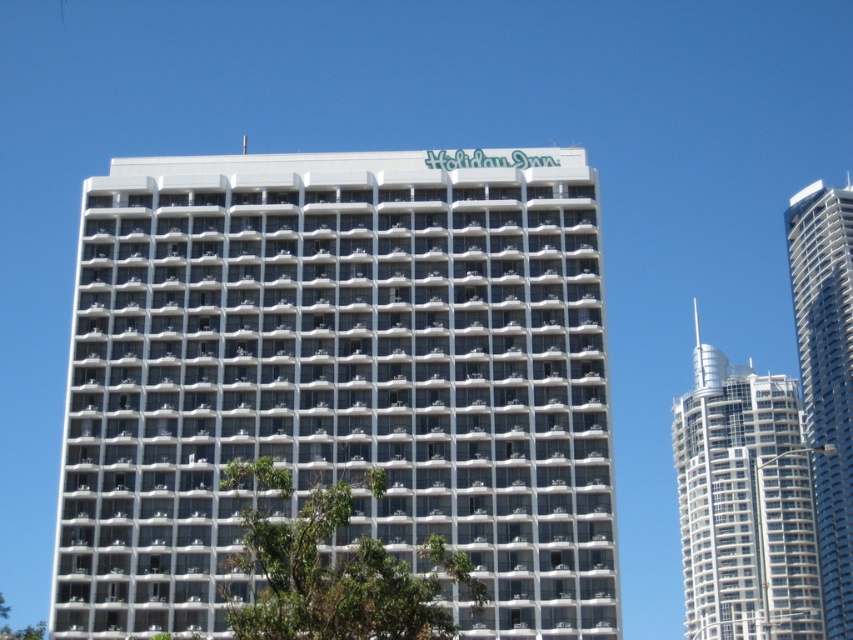
Question: Does white glass skyscraper at right appear on the left side of green leafy tree at lower left?

Choices:
 (A) no
 (B) yes

Answer: (A)

Question: Which of the following is the closest to the observer?

Choices:
 (A) white glass skyscraper at right
 (B) white glass building at center
 (C) green leafy tree at lower left

Answer: (B)

Question: Can you confirm if white glass building at right is bigger than green leafy tree at center?

Choices:
 (A) yes
 (B) no

Answer: (A)

Question: Which point is closer to the camera taking this photo?

Choices:
 (A) (743, 465)
 (B) (814, 372)
 (C) (44, 624)

Answer: (B)

Question: Is white glass building at right positioned behind white glass skyscraper at right?

Choices:
 (A) yes
 (B) no

Answer: (B)

Question: Which point appears closest to the camera in this image?

Choices:
 (A) (831, 404)
 (B) (751, 563)
 (C) (347, 605)

Answer: (C)